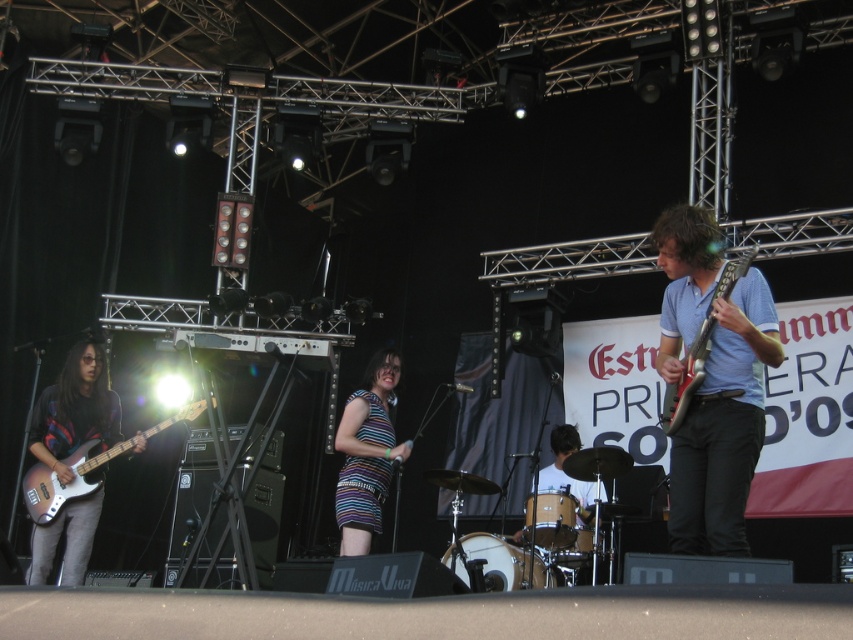
You are a photographer at the concert. You want to take a photo of the striped fabric dress at center and the matte black electric guitar at right. Based on their positions, which one should you focus on first if you start from the left side?

The striped fabric dress at center should be focused on first since it is positioned to the left of the matte black electric guitar at right.

You are a photographer at the concert venue and want to capture a photo of the matte blue shirt at center and the brushed metal bass guitar at left. Based on their positions, which object should you focus on first if you want to ensure both are in the frame without moving the camera?

The matte blue shirt at center is to the right of the brushed metal bass guitar at left, so you should focus on the brushed metal bass guitar at left first to ensure both are in the frame without moving the camera.